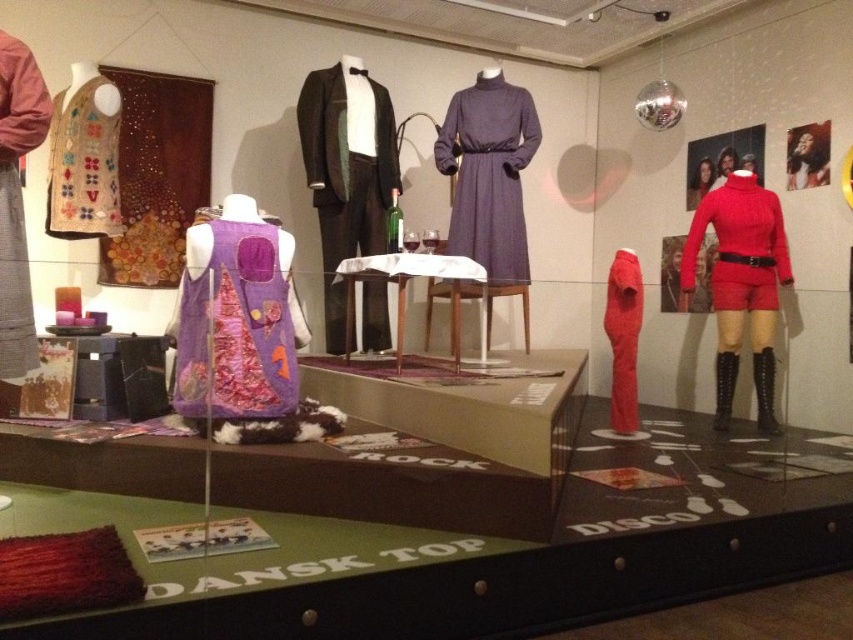
Question: Among these points, which one is nearest to the camera?

Choices:
 (A) (480, 220)
 (B) (746, 250)

Answer: (B)

Question: Based on their relative distances, which object is nearer to the textured wool vest at left?

Choices:
 (A) matte red sweater at right
 (B) purple felt dress at center
 (C) purple fabric dress at upper center
 (D) knitted beige vest at upper left

Answer: (B)

Question: Does purple felt dress at center appear under purple wool dress at center?

Choices:
 (A) no
 (B) yes

Answer: (B)

Question: Among these objects, which one is nearest to the camera?

Choices:
 (A) knitted beige vest at upper left
 (B) shiny black tuxedo at center

Answer: (A)

Question: Does purple felt dress at center appear over matte red jumpsuit at right?

Choices:
 (A) yes
 (B) no

Answer: (A)

Question: Does matte red sweater at right have a lesser width compared to textured wool vest at left?

Choices:
 (A) no
 (B) yes

Answer: (A)